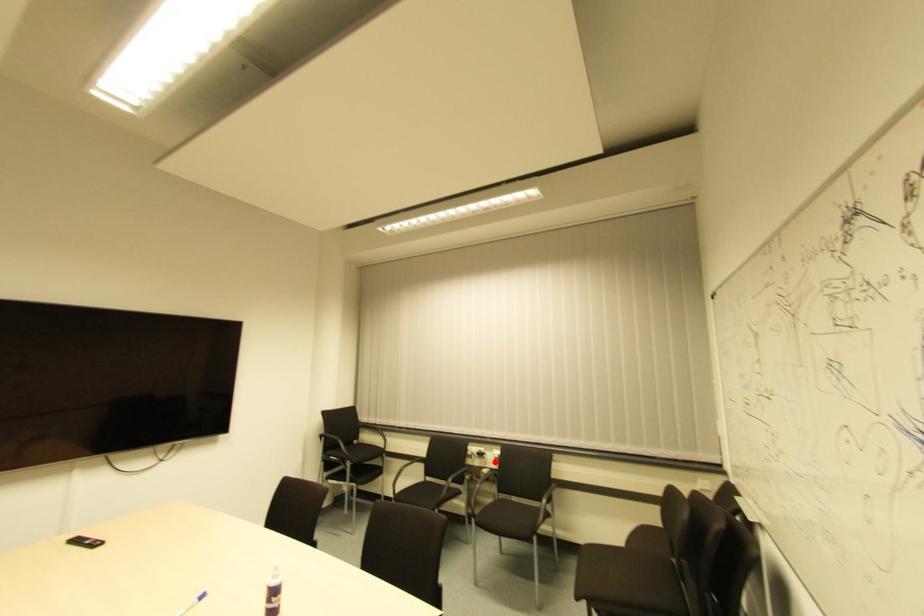
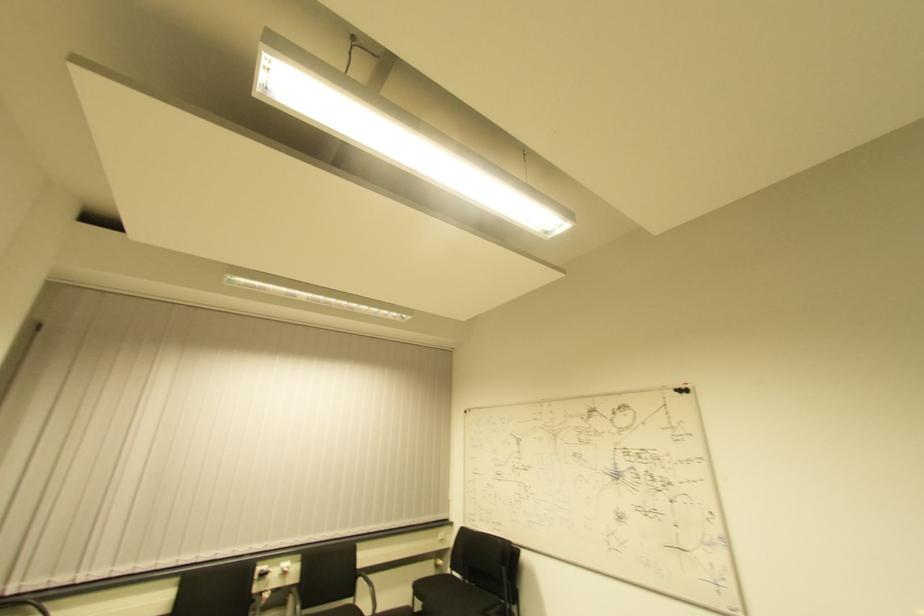
Question: I am providing you with two images of the same scene from different viewpoints. In image1, a red point is highlighted. Considering the same 3D point in image2, which of the following is correct?

Choices:
 (A) It is closer
 (B) It is farther

Answer: (A)